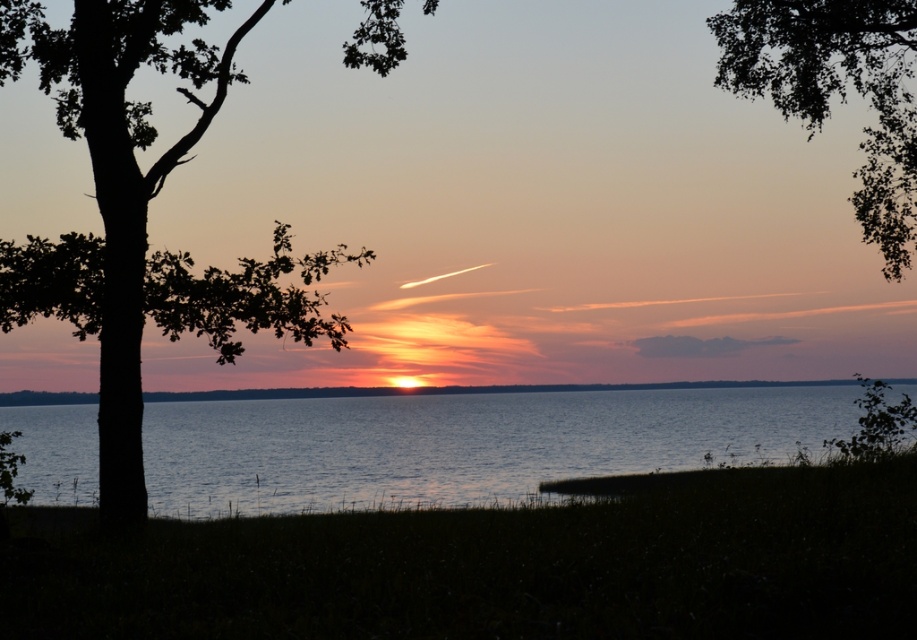
Can you confirm if green leafy tree at upper right is smaller than smooth water at center?

No.

Which of these two, green leafy tree at upper right or smooth water at center, stands shorter?

With less height is smooth water at center.

Is point (865, 164) less distant than point (307, 397)?

That is True.

At what (x,y) coordinates should I click in order to perform the action: click on green leafy tree at upper right. Please return your answer as a coordinate pair (x, y). This screenshot has height=640, width=917. Looking at the image, I should click on pos(837,92).

Can you confirm if blue water at center is positioned to the right of green leafy tree at upper right?

Incorrect, blue water at center is not on the right side of green leafy tree at upper right.

Between point (424, 480) and point (895, 28), which one is positioned behind?

The point (424, 480) is behind.

Image resolution: width=917 pixels, height=640 pixels. What do you see at coordinates (463, 444) in the screenshot?
I see `blue water at center` at bounding box center [463, 444].

Locate an element on the screen. blue water at center is located at coordinates click(x=463, y=444).

Does black tree at left appear under smooth water at center?

Actually, black tree at left is above smooth water at center.

Is black tree at left to the right of smooth water at center from the viewer's perspective?

In fact, black tree at left is to the left of smooth water at center.

Who is more forward, (x=192, y=42) or (x=344, y=392)?

Point (x=192, y=42)

Image resolution: width=917 pixels, height=640 pixels. What are the coordinates of `black tree at left` in the screenshot? It's located at (140, 218).